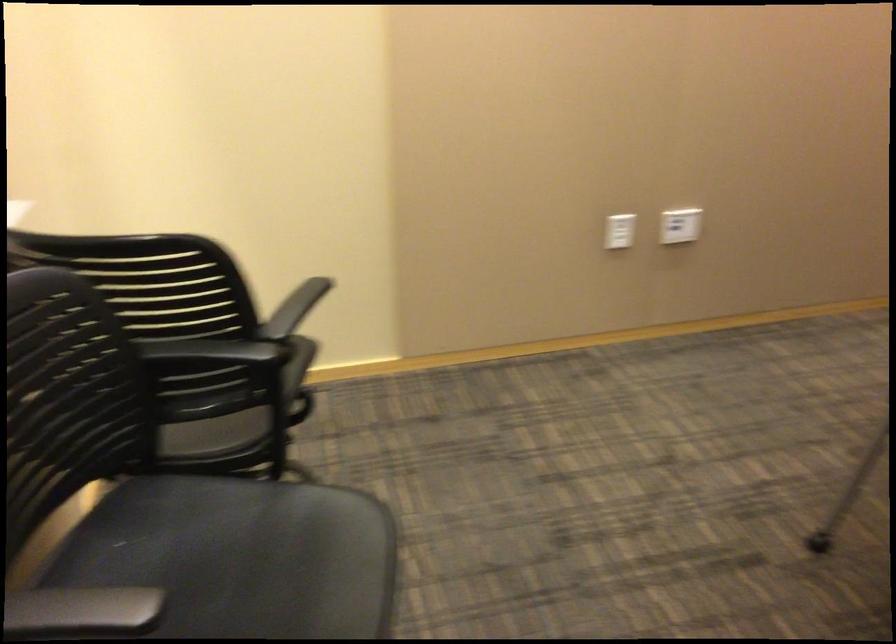
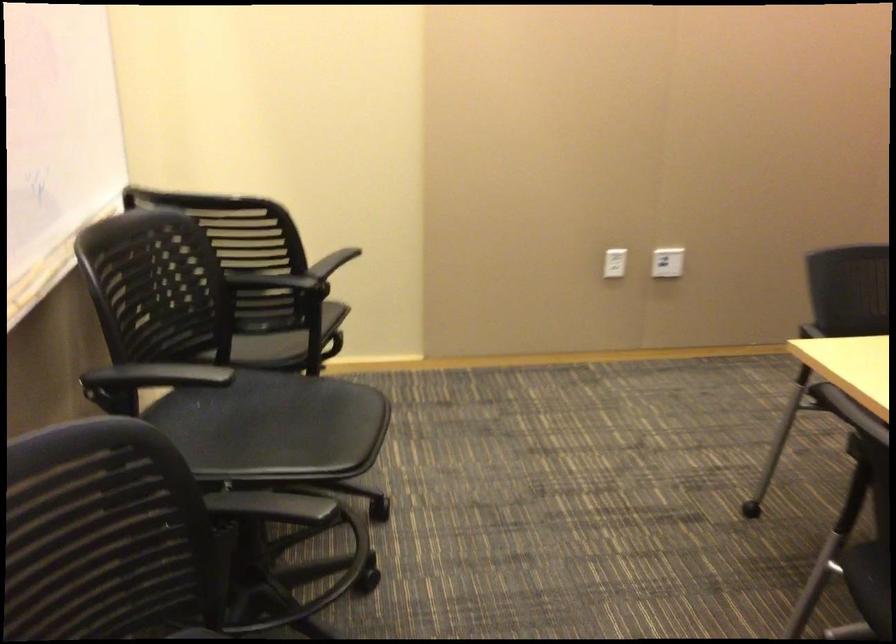
Locate, in the second image, the point that corresponds to point 616,234 in the first image.

(615, 263)